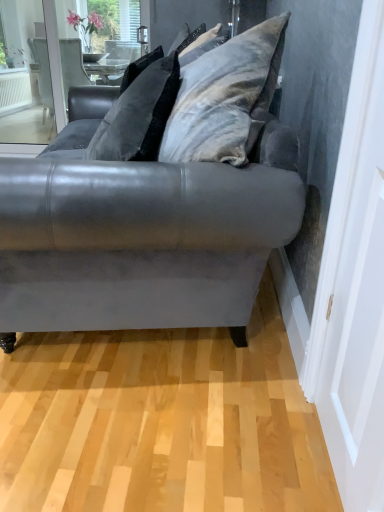
Describe the element at coordinates (139, 67) in the screenshot. The width and height of the screenshot is (384, 512). I see `velvet gray pillow at upper center` at that location.

Find the location of `velvet gray couch at center`. velvet gray couch at center is located at coordinates pyautogui.click(x=140, y=241).

Find the location of a particular element. This screenshot has width=384, height=512. velvet gray pillow at upper center is located at coordinates (139, 67).

The height and width of the screenshot is (512, 384). In order to click on studio couch above the matte gray screen door at right (from the image's perspective) in this screenshot , I will do `click(140, 241)`.

Between velvet gray couch at center and matte gray screen door at right, which one has more height?

matte gray screen door at right is taller.

From a real-world perspective, is velvet gray couch at center located higher than matte gray screen door at right?

Actually, velvet gray couch at center is physically below matte gray screen door at right in the real world.

Is velvet gray couch at center oriented away from matte gray screen door at right?

No, velvet gray couch at center is not facing away from matte gray screen door at right.

Is velvet gray pillow at upper center shorter than matte gray screen door at right?

Yes.

Which of these two, velvet gray pillow at upper center or matte gray screen door at right, is bigger?

velvet gray pillow at upper center is bigger.

Which of these two, velvet gray pillow at upper center or matte gray screen door at right, is wider?

Wider between the two is velvet gray pillow at upper center.

Is velvet gray pillow at upper center with matte gray screen door at right?

No, velvet gray pillow at upper center is not in contact with matte gray screen door at right.

Between velvet gray couch at center and velvet gray pillow at upper center, which one has smaller width?

Thinner between the two is velvet gray pillow at upper center.

Is velvet gray couch at center inside or outside of velvet gray pillow at upper center?

velvet gray couch at center is outside velvet gray pillow at upper center.

Can you confirm if velvet gray couch at center is taller than velvet gray pillow at upper center?

Indeed, velvet gray couch at center has a greater height compared to velvet gray pillow at upper center.

Measure the distance between velvet gray couch at center and velvet gray pillow at upper center.

26.11 inches.

Who is shorter, velvet gray pillow at upper center or velvet gray couch at center?

With less height is velvet gray pillow at upper center.

Based on the photo, measure the distance between velvet gray pillow at upper center and velvet gray couch at center.

velvet gray pillow at upper center and velvet gray couch at center are 26.11 inches apart.

Is velvet gray pillow at upper center facing away from velvet gray couch at center?

velvet gray pillow at upper center does not have its back to velvet gray couch at center.

From the image's perspective, who appears lower, velvet gray pillow at upper center or velvet gray couch at center?

velvet gray couch at center is shown below in the image.

Is matte gray screen door at right spatially inside velvet gray couch at center, or outside of it?

matte gray screen door at right exists outside the volume of velvet gray couch at center.

Considering the relative positions of matte gray screen door at right and velvet gray couch at center in the image provided, is matte gray screen door at right to the left or to the right of velvet gray couch at center?

From the image, it's evident that matte gray screen door at right is to the right of velvet gray couch at center.

From the image's perspective, which object appears higher, matte gray screen door at right or velvet gray couch at center?

velvet gray couch at center appears higher in the image.

Is matte gray screen door at right situated inside velvet gray pillow at upper center or outside?

matte gray screen door at right is outside velvet gray pillow at upper center.

Considering the relative sizes of matte gray screen door at right and velvet gray pillow at upper center in the image provided, is matte gray screen door at right thinner than velvet gray pillow at upper center?

Yes, matte gray screen door at right is thinner than velvet gray pillow at upper center.

Is point (347, 487) closer or farther from the camera than point (126, 82)?

Clearly, point (347, 487) is closer to the camera than point (126, 82).

Locate an element on the screen. This screenshot has width=384, height=512. screen door located on the right of velvet gray couch at center is located at coordinates (354, 287).

I want to click on screen door below the velvet gray pillow at upper center (from a real-world perspective), so click(x=354, y=287).

Which object lies further to the anchor point velvet gray couch at center, matte gray screen door at right or velvet gray pillow at upper center?

Among the two, velvet gray pillow at upper center is located further to velvet gray couch at center.

Looking at the image, which one is located further to matte gray screen door at right, velvet gray couch at center or velvet gray pillow at upper center?

velvet gray pillow at upper center.

Estimate the real-world distances between objects in this image. Which object is further from velvet gray pillow at upper center, matte gray screen door at right or velvet gray couch at center?

matte gray screen door at right is positioned further to the anchor velvet gray pillow at upper center.

From the image, which object appears to be farther from matte gray screen door at right, velvet gray pillow at upper center or velvet gray couch at center?

velvet gray pillow at upper center lies further to matte gray screen door at right than the other object.

Looking at the image, which one is located further to velvet gray pillow at upper center, velvet gray couch at center or matte gray screen door at right?

Based on the image, matte gray screen door at right appears to be further to velvet gray pillow at upper center.

Estimate the real-world distances between objects in this image. Which object is closer to velvet gray couch at center, velvet gray pillow at upper center or matte gray screen door at right?

The object closer to velvet gray couch at center is matte gray screen door at right.

You are a GUI agent. You are given a task and a screenshot of the screen. Output one action in this format:
    pyautogui.click(x=<x>, y=<y>)
    Task: Click on the studio couch between matte gray screen door at right and velvet gray pillow at upper center in the front-back direction
    The width and height of the screenshot is (384, 512).
    Given the screenshot: What is the action you would take?
    click(140, 241)